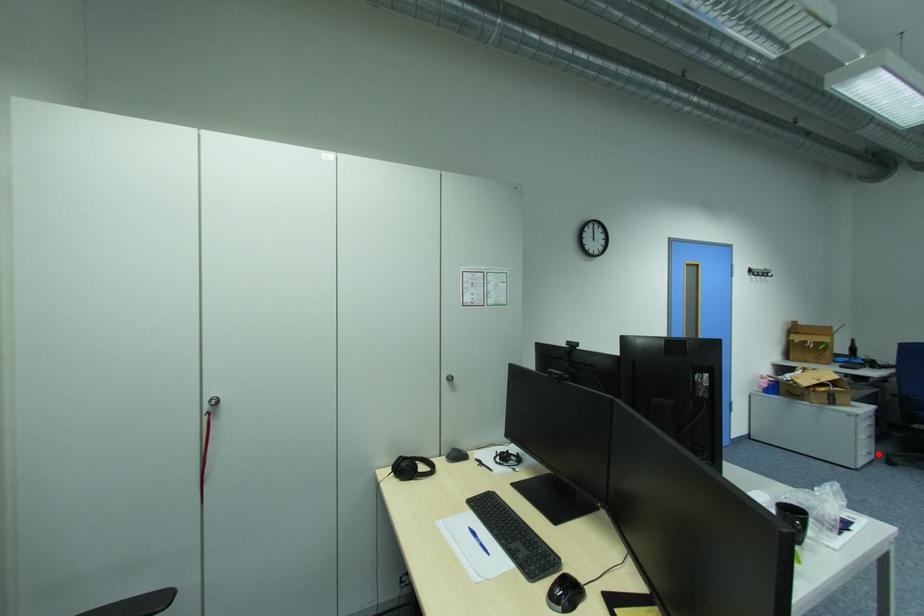
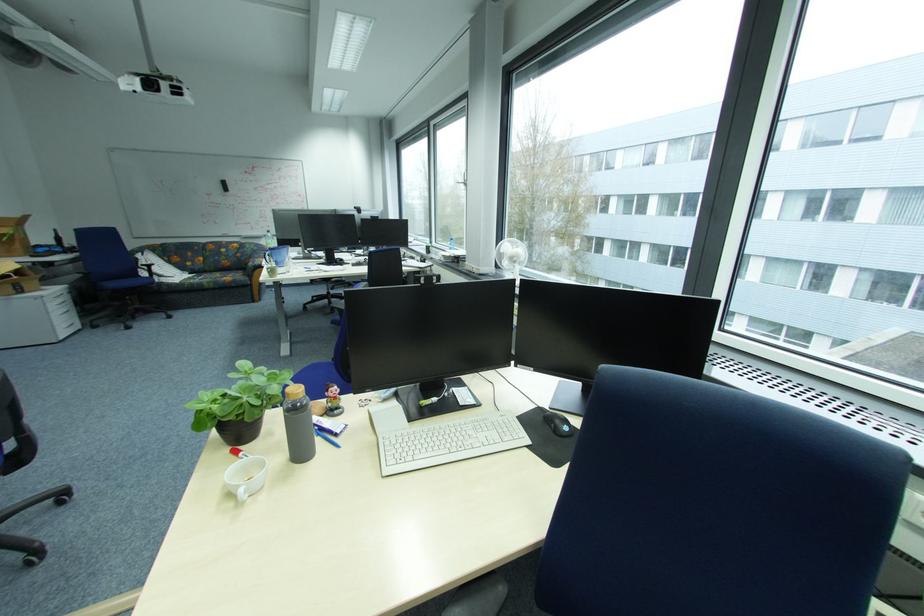
Where in the second image is the point corresponding to the highlighted location from the first image?

(80, 326)